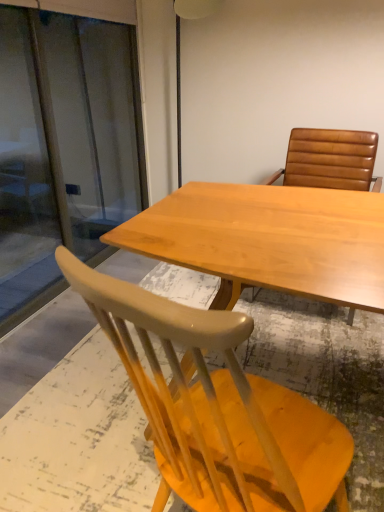
The width and height of the screenshot is (384, 512). What are the coordinates of `vacant space situated above matte yellow chair at lower left, acting as the first chair starting from the bottom (from a real-world perspective)` in the screenshot? It's located at (121, 377).